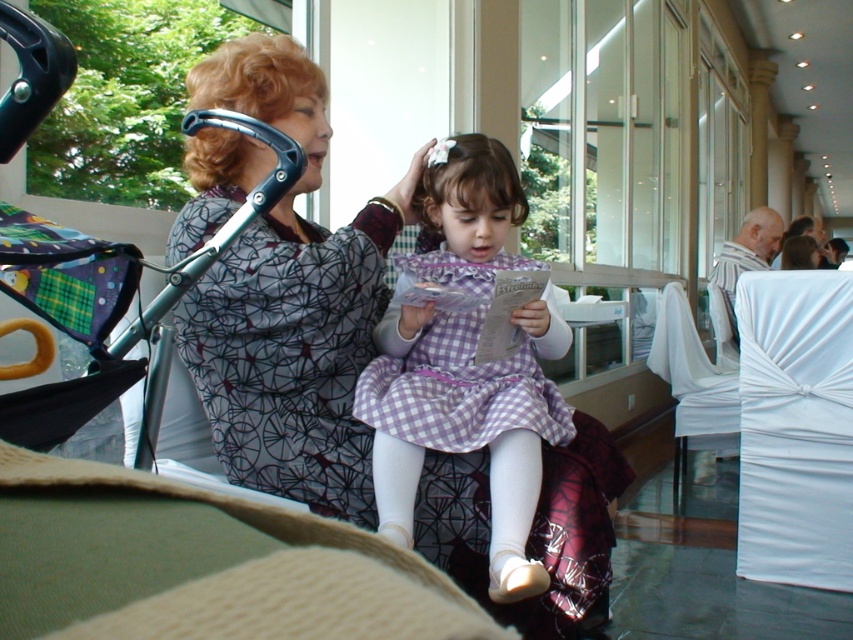
You are a photographer setting up for a family portrait in this space. You want to position the checkered fabric dress at center and the white satin chair at right so that they are exactly 5 feet apart. Based on the current setup, do you need to move them closer or farther apart to achieve the desired distance?

The current distance between the checkered fabric dress at center and the white satin chair at right is 4.76 feet. To reach the desired 5 feet, you need to move them slightly farther apart.